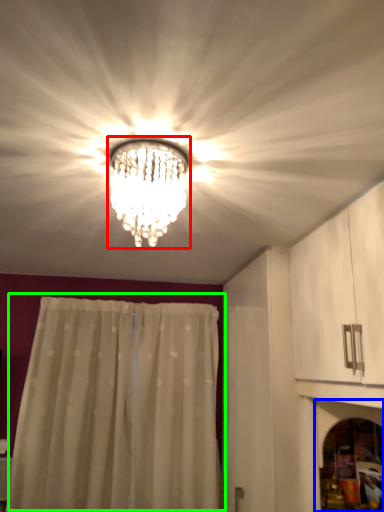
Question: Which object is the farthest from lamp (highlighted by a red box)? Choose among these: screen door (highlighted by a blue box) or curtain (highlighted by a green box).

Choices:
 (A) screen door
 (B) curtain

Answer: (B)